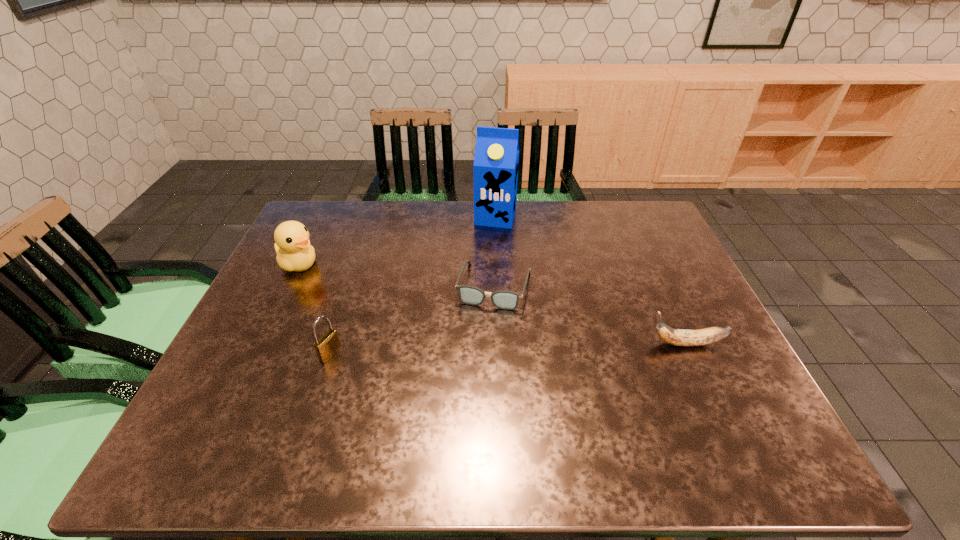
The image size is (960, 540). In order to click on free space on the desktop that is between the third tallest object and the banana and is positioned on the face of the spectacles in this screenshot , I will do `click(476, 349)`.

Locate an element on the screen. This screenshot has width=960, height=540. vacant spot on the desktop that is between the padlock and the banana and is positioned with the cap open on the farthest object is located at coordinates (458, 350).

You are a GUI agent. You are given a task and a screenshot of the screen. Output one action in this format:
    pyautogui.click(x=<x>, y=<y>)
    Task: Click on the vacant spot on the desktop that is between the second object from left to right and the banana and is positioned on the face of the second tallest object
    
    Given the screenshot: What is the action you would take?
    pyautogui.click(x=494, y=349)